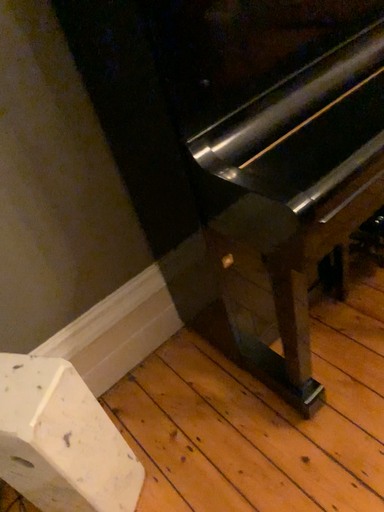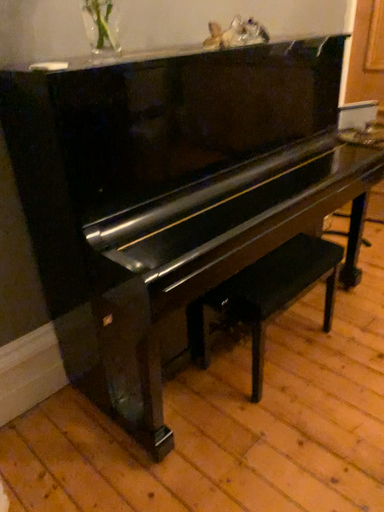
Question: Which way did the camera rotate in the video?

Choices:
 (A) rotated upward
 (B) rotated downward

Answer: (A)